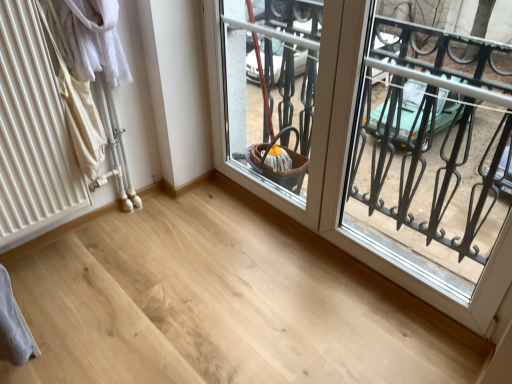
What do you see at coordinates (32, 130) in the screenshot? The width and height of the screenshot is (512, 384). I see `white matte radiator at left` at bounding box center [32, 130].

At what (x,y) coordinates should I click in order to perform the action: click on white matte radiator at left. Please return your answer as a coordinate pair (x, y). This screenshot has width=512, height=384. Looking at the image, I should click on (32, 130).

Identify the location of white matte radiator at left. The height and width of the screenshot is (384, 512). (32, 130).